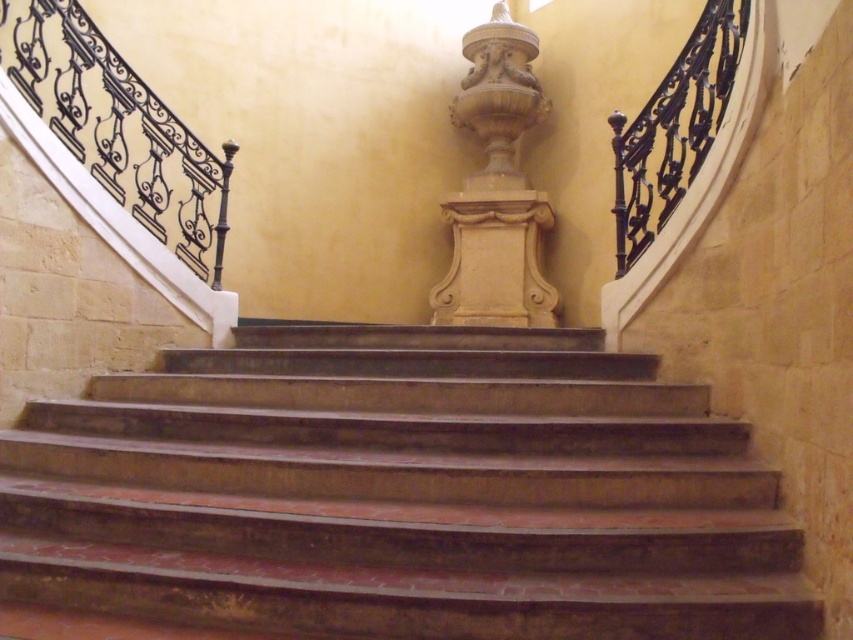
Which is below, black wrought iron railing at upper left or white marble vase at center?

black wrought iron railing at upper left is below.

Does point (67, 17) come in front of point (524, 77)?

That is True.

Describe the element at coordinates (119, 128) in the screenshot. The width and height of the screenshot is (853, 640). I see `black wrought iron railing at upper left` at that location.

This screenshot has width=853, height=640. Find the location of `black wrought iron railing at upper left`. black wrought iron railing at upper left is located at coordinates (119, 128).

Is brown stone stairs at center behind white marble vase at center?

No, brown stone stairs at center is in front of white marble vase at center.

Who is positioned more to the right, brown stone stairs at center or white marble vase at center?

white marble vase at center

Between point (701, 394) and point (503, 300), which one is positioned in front?

Point (701, 394)

You are a GUI agent. You are given a task and a screenshot of the screen. Output one action in this format:
    pyautogui.click(x=<x>, y=<y>)
    Task: Click on the brown stone stairs at center
    The height and width of the screenshot is (640, 853).
    Given the screenshot: What is the action you would take?
    pyautogui.click(x=393, y=497)

Does point (517, 224) come closer to viewer compared to point (637, 205)?

No.

What do you see at coordinates (496, 188) in the screenshot? I see `white marble vase at center` at bounding box center [496, 188].

Identify the location of white marble vase at center. (496, 188).